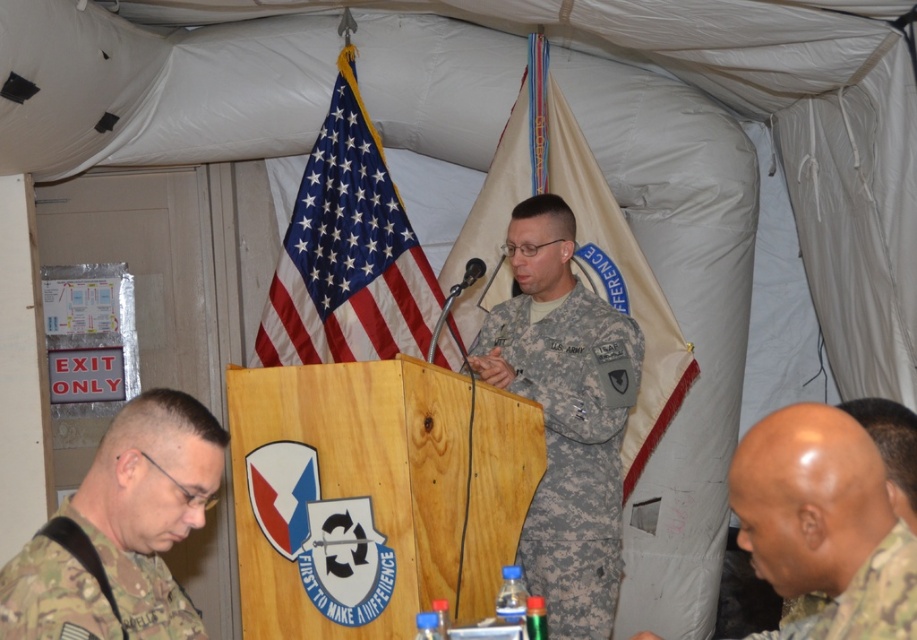
You are a photographer positioned at the origin point in the tent. You need to capture a photo of the camouflage fabric uniform at center. What are the coordinates where you should aim your camera?

The camouflage fabric uniform at center is located at coordinates (572, 449). Aim your camera at those coordinates to capture the photo.

You are a photographer taking a picture of the scene. You notice two points in the image at coordinates point (359, 221) and point (665, 376). Which point is closer to the camera?

Point (359, 221) is further to the camera than point (665, 376). Therefore, point (665, 376) is closer to the camera.

In the scene shown: You are attending a military ceremony and need to locate the blue satin flag at upper center and the american flag at center. From your current position, which flag is closer to you?

The blue satin flag at upper center is closer to you because it is positioned further to the viewer than the american flag at center.